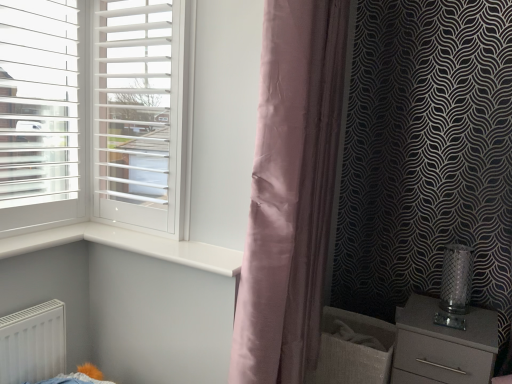
Question: Considering the relative sizes of satin grey chest of drawers at lower right and white glossy window sill at center in the image provided, is satin grey chest of drawers at lower right thinner than white glossy window sill at center?

Choices:
 (A) no
 (B) yes

Answer: (A)

Question: Is satin grey chest of drawers at lower right turned away from white glossy window sill at center?

Choices:
 (A) yes
 (B) no

Answer: (B)

Question: Is satin grey chest of drawers at lower right positioned in front of white glossy window sill at center?

Choices:
 (A) no
 (B) yes

Answer: (A)

Question: From the image's perspective, is satin grey chest of drawers at lower right beneath white glossy window sill at center?

Choices:
 (A) no
 (B) yes

Answer: (B)

Question: Is satin grey chest of drawers at lower right aimed at white glossy window sill at center?

Choices:
 (A) yes
 (B) no

Answer: (B)

Question: Is satin grey chest of drawers at lower right taller or shorter than white matte screen door at left?

Choices:
 (A) tall
 (B) short

Answer: (B)

Question: Is satin grey chest of drawers at lower right inside or outside of white matte screen door at left?

Choices:
 (A) inside
 (B) outside

Answer: (B)

Question: Is point (456, 377) positioned closer to the camera than point (158, 175)?

Choices:
 (A) farther
 (B) closer

Answer: (B)

Question: Considering the relative positions of satin grey chest of drawers at lower right and white matte screen door at left in the image provided, is satin grey chest of drawers at lower right to the left or to the right of white matte screen door at left?

Choices:
 (A) right
 (B) left

Answer: (A)

Question: Would you say white matte screen door at left is inside or outside satin grey chest of drawers at lower right?

Choices:
 (A) inside
 (B) outside

Answer: (B)

Question: From the image's perspective, is white matte screen door at left above or below satin grey chest of drawers at lower right?

Choices:
 (A) below
 (B) above

Answer: (B)

Question: From a real-world perspective, relative to satin grey chest of drawers at lower right, is white matte screen door at left vertically above or below?

Choices:
 (A) below
 (B) above

Answer: (B)

Question: Looking at their shapes, would you say white matte screen door at left is wider or thinner than satin grey chest of drawers at lower right?

Choices:
 (A) thin
 (B) wide

Answer: (A)

Question: From the image's perspective, relative to silky pink curtain at center, is white matte screen door at left above or below?

Choices:
 (A) above
 (B) below

Answer: (A)

Question: Which is correct: white matte screen door at left is inside silky pink curtain at center, or outside of it?

Choices:
 (A) outside
 (B) inside

Answer: (A)